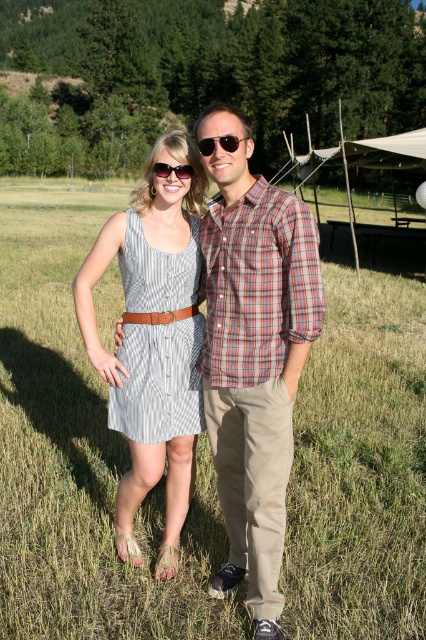
Question: Which point is farther from the camera taking this photo?

Choices:
 (A) (132, 429)
 (B) (186, 604)
 (C) (313, 333)
 (D) (132, 419)

Answer: (B)

Question: Which of the following is the farthest from the observer?

Choices:
 (A) striped cotton dress at center
 (B) green grass at center

Answer: (B)

Question: Is striped fabric dress at center in front of brown leather belt at center?

Choices:
 (A) no
 (B) yes

Answer: (B)

Question: Does striped fabric dress at center appear on the left side of matte black sunglasses at center?

Choices:
 (A) no
 (B) yes

Answer: (B)

Question: Which of these objects is positioned farthest from the brown leather belt at center?

Choices:
 (A) striped fabric dress at center
 (B) plaid cotton shirt at center

Answer: (B)

Question: Can you confirm if striped cotton dress at center is bigger than brown leather belt at center?

Choices:
 (A) yes
 (B) no

Answer: (A)